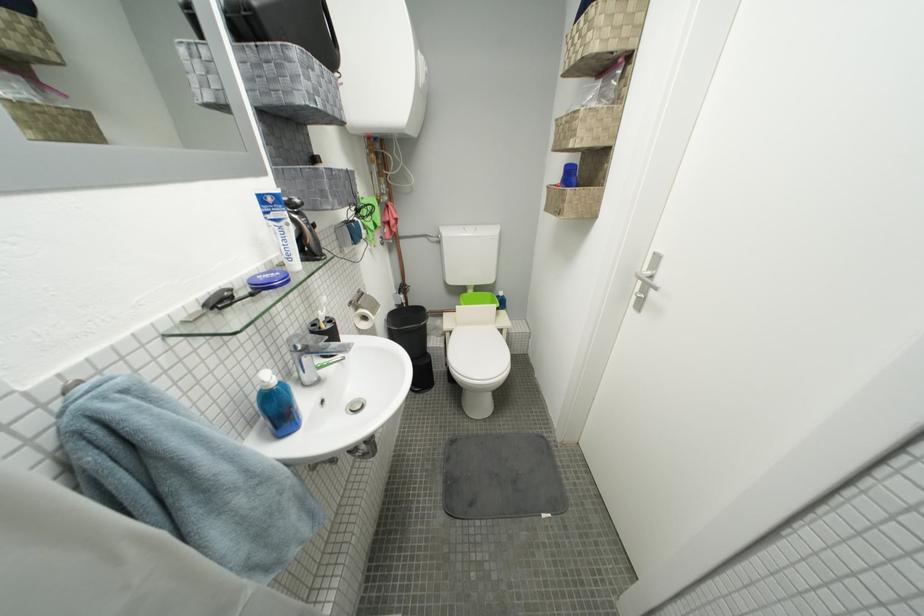
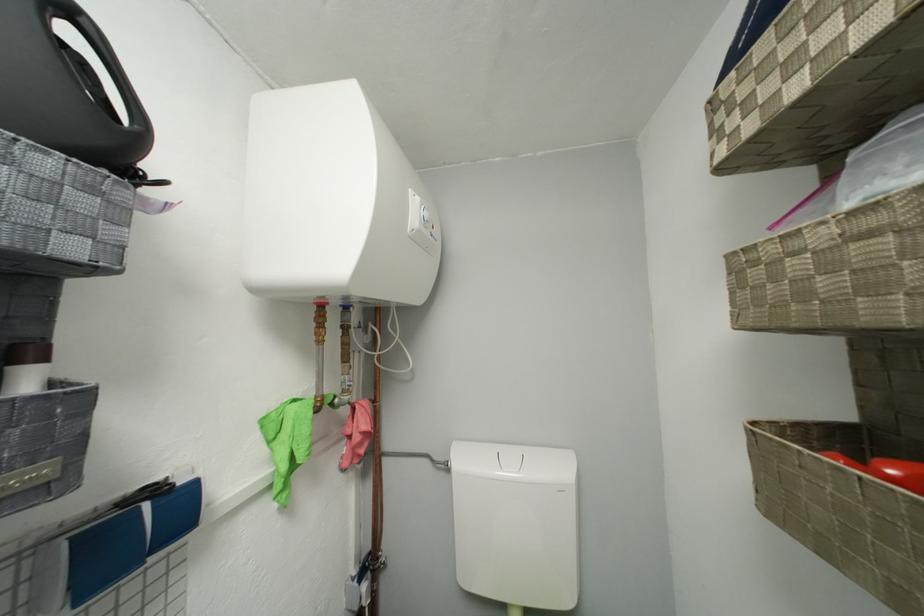
Find the pixel in the second image that matches (382,231) in the first image.

(293, 469)